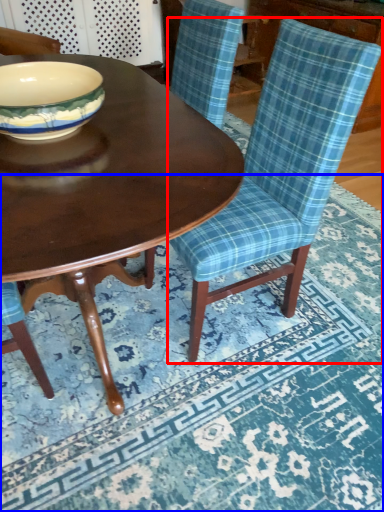
Question: Which of the following is the farthest to the observer, chair (highlighted by a red box) or place mat (highlighted by a blue box)?

Choices:
 (A) chair
 (B) place mat

Answer: (A)